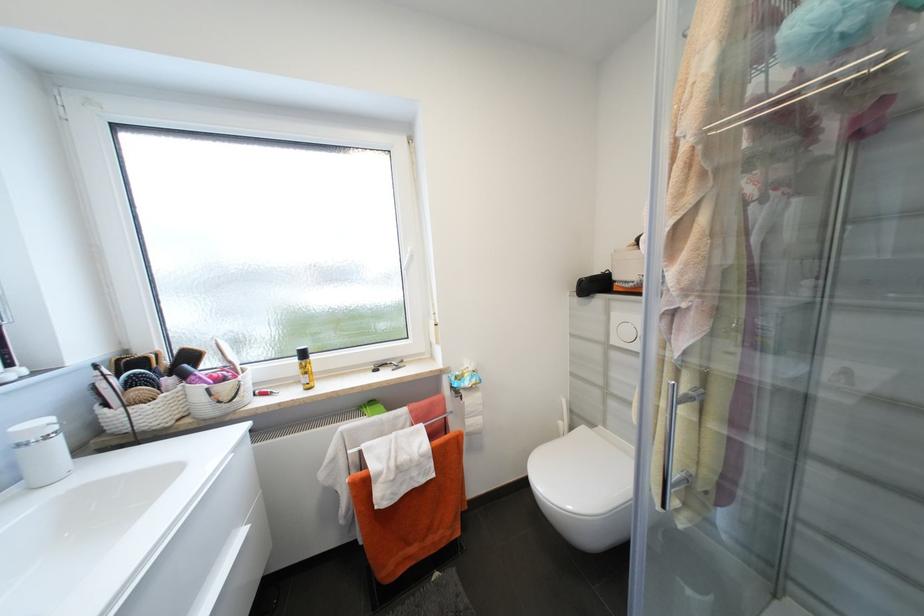
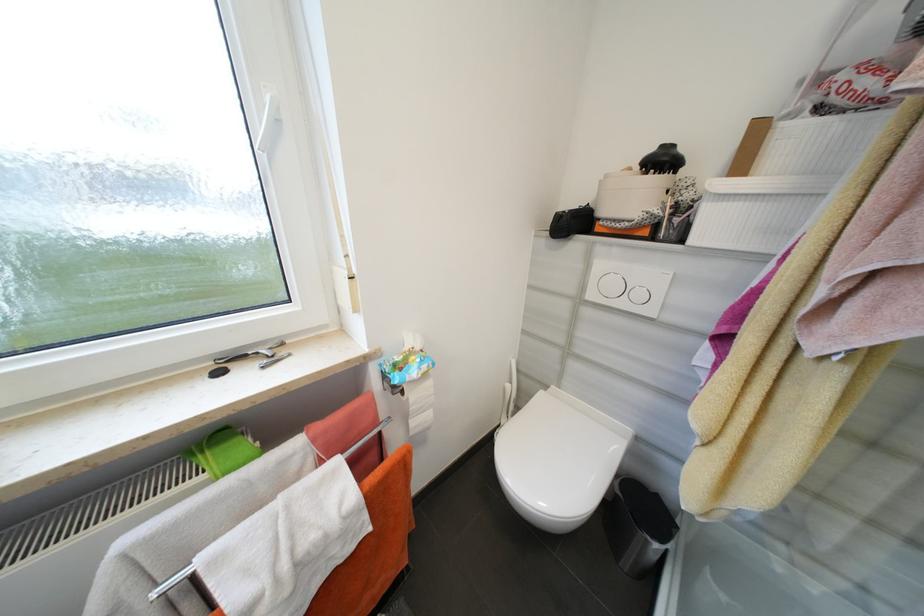
In the second image, find the point that corresponds to (x=480, y=382) in the first image.

(430, 368)